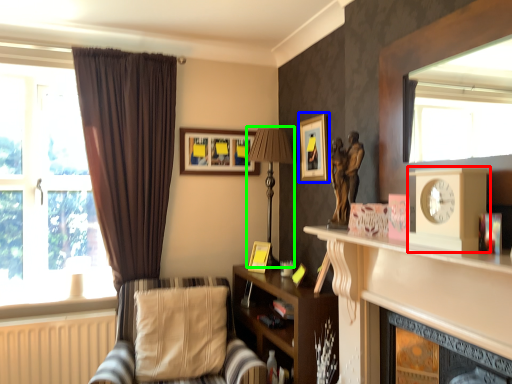
Question: Considering the real-world distances, which object is closest to clock (highlighted by a red box)? picture frame (highlighted by a blue box) or lamp (highlighted by a green box).

Choices:
 (A) picture frame
 (B) lamp

Answer: (A)